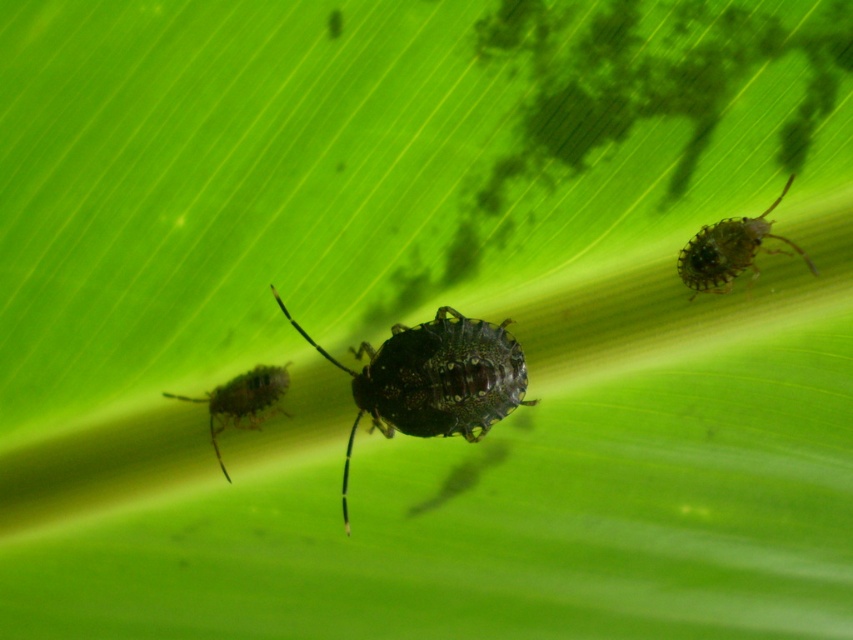
You are a biologist examining a leaf with three shield bugs. You notice a specific point at coordinates (730, 250). Which bug is this point located on?

The point at coordinates (730, 250) is located on the shiny dark green bug at upper right.

You are a small insect trying to travel from the shiny dark green bug at center to the shiny dark green bug at upper right on the leaf. The leaf is 12 inches wide. Can you fit your journey on the leaf without going off the edge?

The distance between the shiny dark green bug at center and the shiny dark green bug at upper right is 14.05 inches. Since the leaf is only 12 inches wide, the journey would exceed the leaf width, so you would go off the edge.